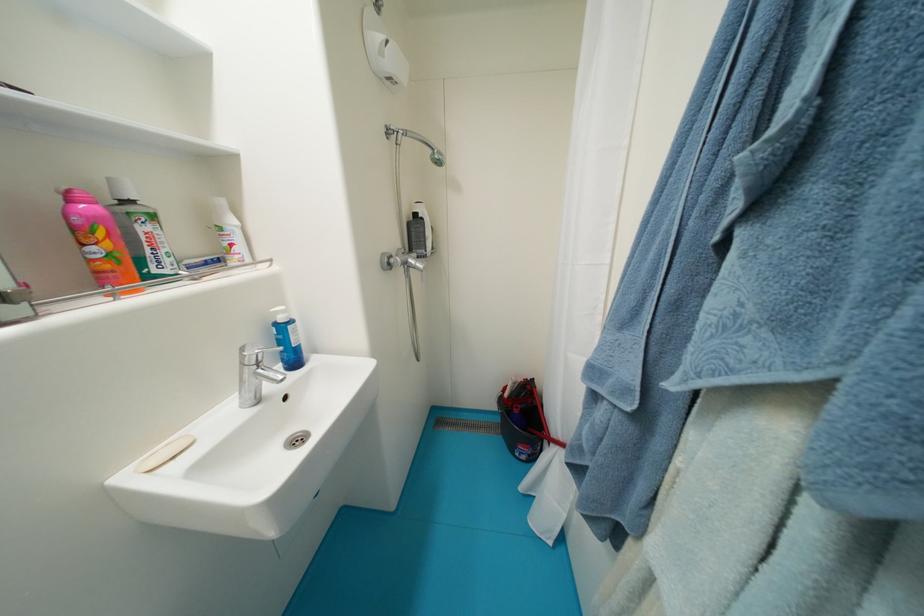
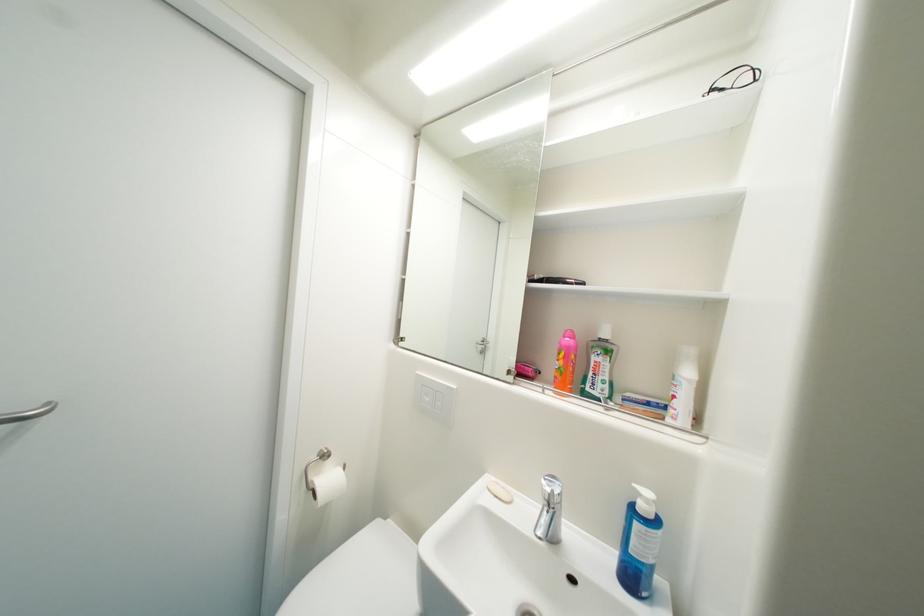
In the second image, find the point that corresponds to pixel 180 460 in the first image.

(503, 498)